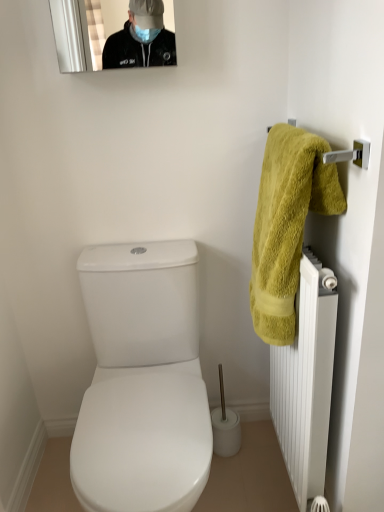
The image size is (384, 512). What are the coordinates of `white plastic toilet brush at center` in the screenshot? It's located at (225, 426).

The image size is (384, 512). Describe the element at coordinates (306, 381) in the screenshot. I see `white matte radiator at right` at that location.

You are a GUI agent. You are given a task and a screenshot of the screen. Output one action in this format:
    pyautogui.click(x=<x>, y=<y>)
    Task: Click on the yellow fluffy towel at right
    This screenshot has height=512, width=384.
    Given the screenshot: What is the action you would take?
    pyautogui.click(x=287, y=224)

Relative to white plastic toilet brush at center, is yellow fluffy towel at right in front or behind?

Visually, yellow fluffy towel at right is located in front of white plastic toilet brush at center.

Who is shorter, yellow fluffy towel at right or white plastic toilet brush at center?

With less height is white plastic toilet brush at center.

Considering the points (317, 150) and (230, 421), which point is behind, point (317, 150) or point (230, 421)?

The point (230, 421) is behind.

Is point (218, 412) closer or farther from the camera than point (265, 338)?

Point (218, 412) is farther from the camera than point (265, 338).

Between white plastic toilet brush at center and yellow fluffy towel at right, which one has larger size?

yellow fluffy towel at right.

Is white plastic toilet brush at center shorter than yellow fluffy towel at right?

Yes.

In the scene shown: From a real-world perspective, which object stands above the other?

yellow fluffy towel at right.

Is white plastic toilet brush at center turned away from white matte radiator at right?

white plastic toilet brush at center does not have its back to white matte radiator at right.

Between white plastic toilet brush at center and white matte radiator at right, which one has larger size?

With larger size is white matte radiator at right.

Does white plastic toilet brush at center have a lesser height compared to white matte radiator at right?

Indeed, white plastic toilet brush at center has a lesser height compared to white matte radiator at right.

From the image's perspective, which is above, yellow fluffy towel at right or white matte radiator at right?

yellow fluffy towel at right appears higher in the image.

Considering the relative sizes of yellow fluffy towel at right and white matte radiator at right in the image provided, is yellow fluffy towel at right wider than white matte radiator at right?

Correct, the width of yellow fluffy towel at right exceeds that of white matte radiator at right.

Between yellow fluffy towel at right and white matte radiator at right, which one has less height?

Standing shorter between the two is yellow fluffy towel at right.

Is yellow fluffy towel at right further to camera compared to white matte radiator at right?

That is False.

Locate an element on the screen. This screenshot has height=512, width=384. brush lying behind the white matte radiator at right is located at coordinates (225, 426).

Considering the relative sizes of white matte radiator at right and white plastic toilet brush at center in the image provided, is white matte radiator at right bigger than white plastic toilet brush at center?

Yes.

From the image's perspective, is white matte radiator at right above white plastic toilet brush at center?

Indeed, from the image's perspective, white matte radiator at right is shown above white plastic toilet brush at center.

Is white matte radiator at right turned away from white plastic toilet brush at center?

white matte radiator at right is not turned away from white plastic toilet brush at center.

Who is bigger, white matte radiator at right or yellow fluffy towel at right?

white matte radiator at right.

Is point (283, 388) behind point (306, 173)?

Yes, point (283, 388) is behind point (306, 173).

From the image's perspective, is white matte radiator at right beneath yellow fluffy towel at right?

Indeed, from the image's perspective, white matte radiator at right is shown beneath yellow fluffy towel at right.

Image resolution: width=384 pixels, height=512 pixels. Find the location of `brush below the yellow fluffy towel at right (from the image's perspective)`. brush below the yellow fluffy towel at right (from the image's perspective) is located at coordinates (225, 426).

The width and height of the screenshot is (384, 512). Identify the location of brush that appears behind the yellow fluffy towel at right. (225, 426).

From the image, which object appears to be nearer to white matte radiator at right, yellow fluffy towel at right or white plastic toilet brush at center?

yellow fluffy towel at right is positioned closer to the anchor white matte radiator at right.

Looking at the image, which one is located further to white plastic toilet brush at center, yellow fluffy towel at right or white matte radiator at right?

yellow fluffy towel at right lies further to white plastic toilet brush at center than the other object.

Looking at the image, which one is located closer to white matte radiator at right, white plastic toilet brush at center or yellow fluffy towel at right?

Among the two, yellow fluffy towel at right is located nearer to white matte radiator at right.

Considering their positions, is white matte radiator at right positioned further to yellow fluffy towel at right than white plastic toilet brush at center?

Among the two, white plastic toilet brush at center is located further to yellow fluffy towel at right.

Based on their spatial positions, is white plastic toilet brush at center or white matte radiator at right closer to yellow fluffy towel at right?

Among the two, white matte radiator at right is located nearer to yellow fluffy towel at right.

Looking at the image, which one is located further to white plastic toilet brush at center, white matte radiator at right or yellow fluffy towel at right?

Among the two, yellow fluffy towel at right is located further to white plastic toilet brush at center.

This screenshot has width=384, height=512. I want to click on radiator between yellow fluffy towel at right and white plastic toilet brush at center from front to back, so click(306, 381).